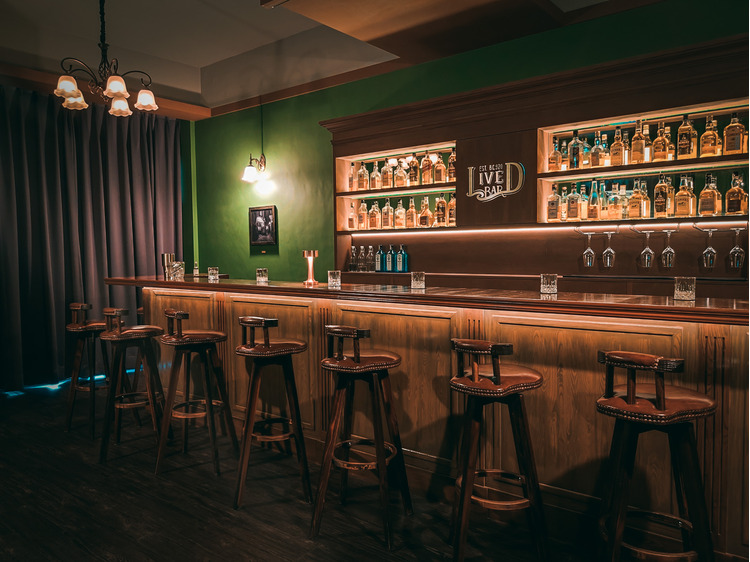
Identify the location of barstools. The width and height of the screenshot is (750, 562). (655, 415), (501, 398), (374, 370), (262, 353), (189, 342), (132, 335), (94, 329).